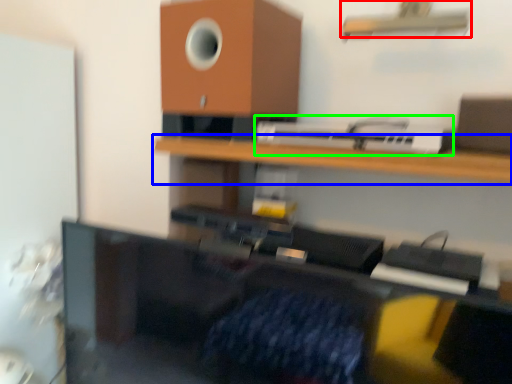
Question: Estimate the real-world distances between objects in this image. Which object is farther from shelf (highlighted by a red box), shelf (highlighted by a blue box) or printer (highlighted by a green box)?

Choices:
 (A) shelf
 (B) printer

Answer: (A)